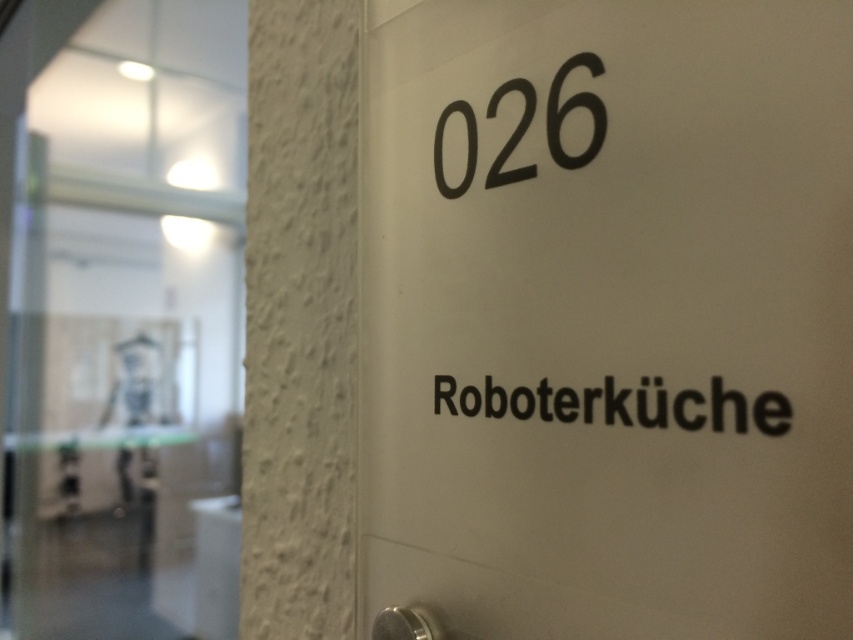
You are standing in front of a door with a sign. You need to read the text on the sign to find the Robot Kitchen. Which object should you look at first, the white matte sign at center or the black matte text at center?

The white matte sign at center has a larger size compared to the black matte text at center, so you should look at the white matte sign at center first because it is bigger and more noticeable.

You are standing in front of the door and need to read both the white matte sign at center and the black matte number at upper center. Which one do you think is taller?

The white matte sign at center is taller than the black matte number at upper center.